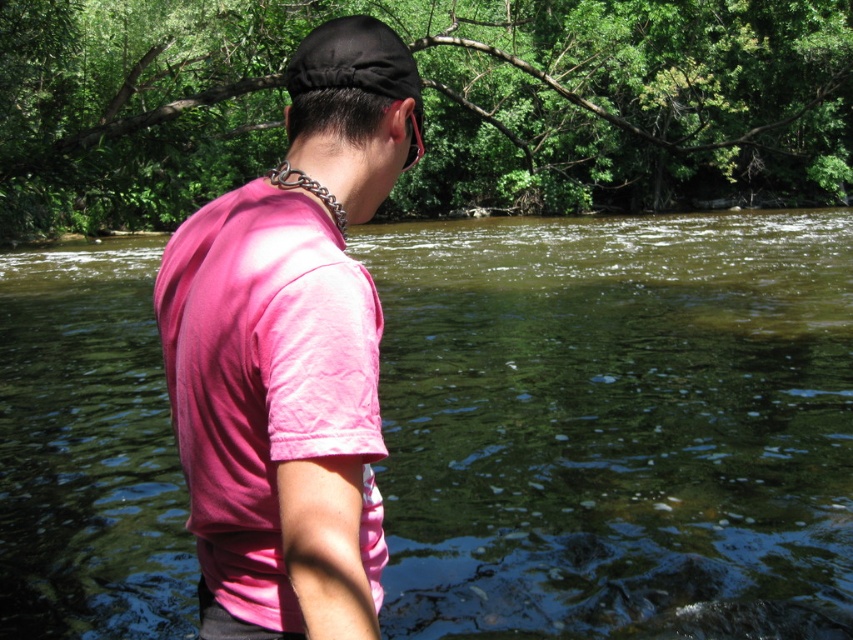
Question: Which object appears farthest from the camera in this image?

Choices:
 (A) pink cotton shirt at center
 (B) clear water at creek center

Answer: (B)

Question: Does clear water at creek center appear under pink cotton shirt at center?

Choices:
 (A) no
 (B) yes

Answer: (A)

Question: Which of the following is the closest to the observer?

Choices:
 (A) (619, 304)
 (B) (289, 406)

Answer: (B)

Question: Does clear water at creek center appear under pink cotton shirt at center?

Choices:
 (A) no
 (B) yes

Answer: (A)

Question: Is clear water at creek center in front of pink cotton shirt at center?

Choices:
 (A) yes
 (B) no

Answer: (B)